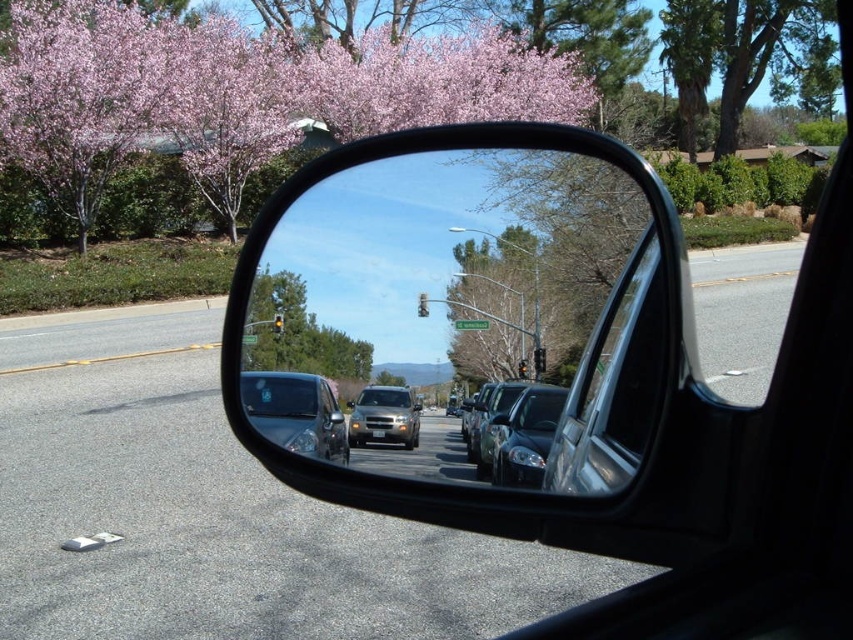
Question: Does green leafy tree at center appear over metallic silver suv at center?

Choices:
 (A) yes
 (B) no

Answer: (A)

Question: Among these points, which one is nearest to the camera?

Choices:
 (A) (282, 388)
 (B) (788, 20)
 (C) (363, 353)

Answer: (C)

Question: Is clear glass car window at center to the left of metallic silver suv at center from the viewer's perspective?

Choices:
 (A) no
 (B) yes

Answer: (A)

Question: Is pink blossoms at upper left further to camera compared to shiny black sedan at center?

Choices:
 (A) yes
 (B) no

Answer: (A)

Question: Among these points, which one is nearest to the camera?

Choices:
 (A) (561, 218)
 (B) (289, 384)

Answer: (A)

Question: Which point is closer to the camera taking this photo?

Choices:
 (A) (608, 371)
 (B) (795, 77)
 (C) (323, 394)
 (D) (399, 396)

Answer: (A)